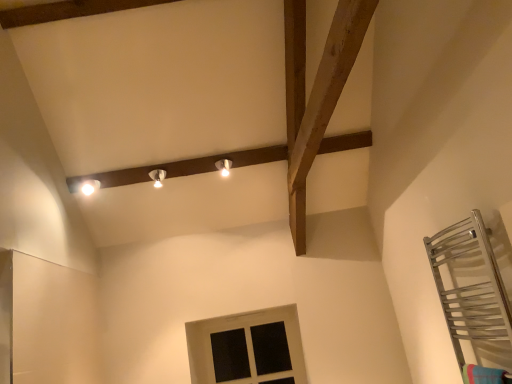
Question: Are matte white light fixture at upper center, marked as the first light fixture in a right-to-left arrangement, and white painted wood window at lower center making contact?

Choices:
 (A) yes
 (B) no

Answer: (B)

Question: Can you confirm if matte white light fixture at upper center, marked as the first light fixture in a right-to-left arrangement, is wider than white painted wood window at lower center?

Choices:
 (A) no
 (B) yes

Answer: (B)

Question: From the image's perspective, does matte white light fixture at upper center, the third light fixture positioned from the left, appear higher than white painted wood window at lower center?

Choices:
 (A) no
 (B) yes

Answer: (B)

Question: Are matte white light fixture at upper center, marked as the first light fixture in a right-to-left arrangement, and white painted wood window at lower center far apart?

Choices:
 (A) yes
 (B) no

Answer: (A)

Question: Is matte white light fixture at upper center, marked as the first light fixture in a right-to-left arrangement, behind white painted wood window at lower center?

Choices:
 (A) yes
 (B) no

Answer: (B)

Question: Is matte white light fixture at upper center, the third light fixture positioned from the left, smaller than white painted wood window at lower center?

Choices:
 (A) yes
 (B) no

Answer: (A)

Question: Can you confirm if matte white light fixture at center, the 2th light fixture from the right, is shorter than matte white light fixture at upper left, the 3th light fixture in the right-to-left sequence?

Choices:
 (A) yes
 (B) no

Answer: (B)

Question: Is matte white light fixture at center, which appears as the 2th light fixture when viewed from the left, located outside matte white light fixture at upper left, the 1th light fixture from the left?

Choices:
 (A) yes
 (B) no

Answer: (A)

Question: Considering the relative sizes of matte white light fixture at center, the 2th light fixture from the right, and matte white light fixture at upper left, the 3th light fixture in the right-to-left sequence, in the image provided, is matte white light fixture at center, the 2th light fixture from the right, smaller than matte white light fixture at upper left, the 3th light fixture in the right-to-left sequence,?

Choices:
 (A) no
 (B) yes

Answer: (B)

Question: Does matte white light fixture at center, which appears as the 2th light fixture when viewed from the left, have a lesser width compared to matte white light fixture at upper left, the 3th light fixture in the right-to-left sequence?

Choices:
 (A) no
 (B) yes

Answer: (B)

Question: Is matte white light fixture at center, which appears as the 2th light fixture when viewed from the left, facing away from matte white light fixture at upper left, the 3th light fixture in the right-to-left sequence?

Choices:
 (A) yes
 (B) no

Answer: (B)

Question: Can you confirm if matte white light fixture at center, which appears as the 2th light fixture when viewed from the left, is wider than matte white light fixture at upper left, the 1th light fixture from the left?

Choices:
 (A) yes
 (B) no

Answer: (B)

Question: Does matte white light fixture at upper left, the 3th light fixture in the right-to-left sequence, have a lesser height compared to matte white light fixture at upper center, marked as the first light fixture in a right-to-left arrangement?

Choices:
 (A) no
 (B) yes

Answer: (A)